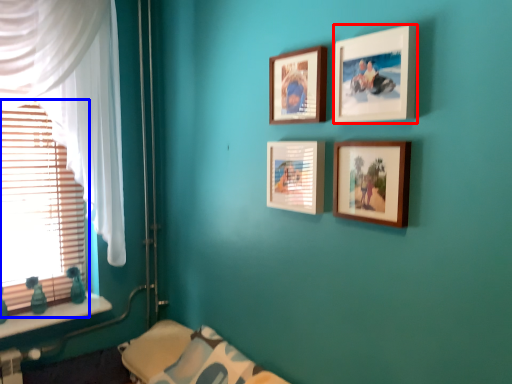
Question: Which point is closer to the camera, picture frame (highlighted by a red box) or window blind (highlighted by a blue box)?

Choices:
 (A) picture frame
 (B) window blind

Answer: (A)